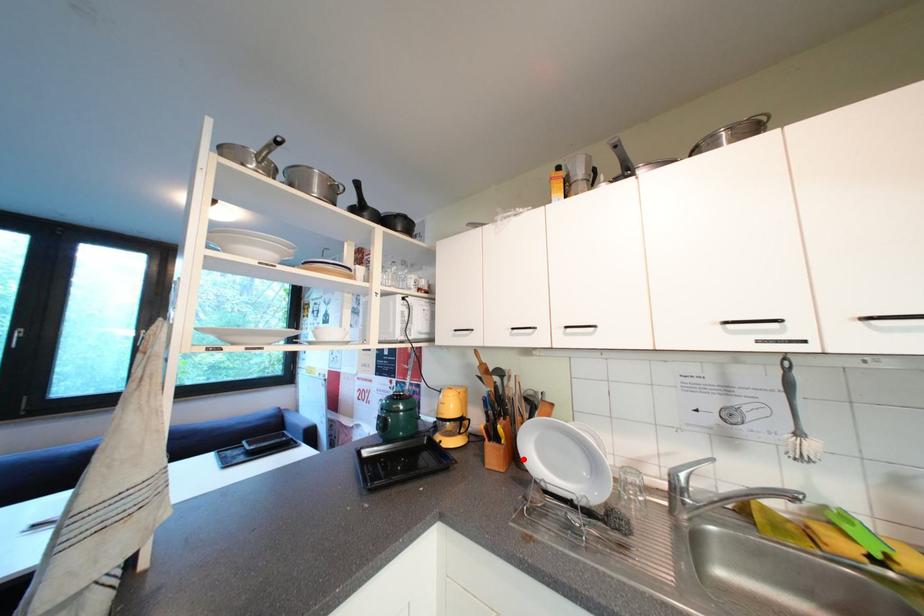
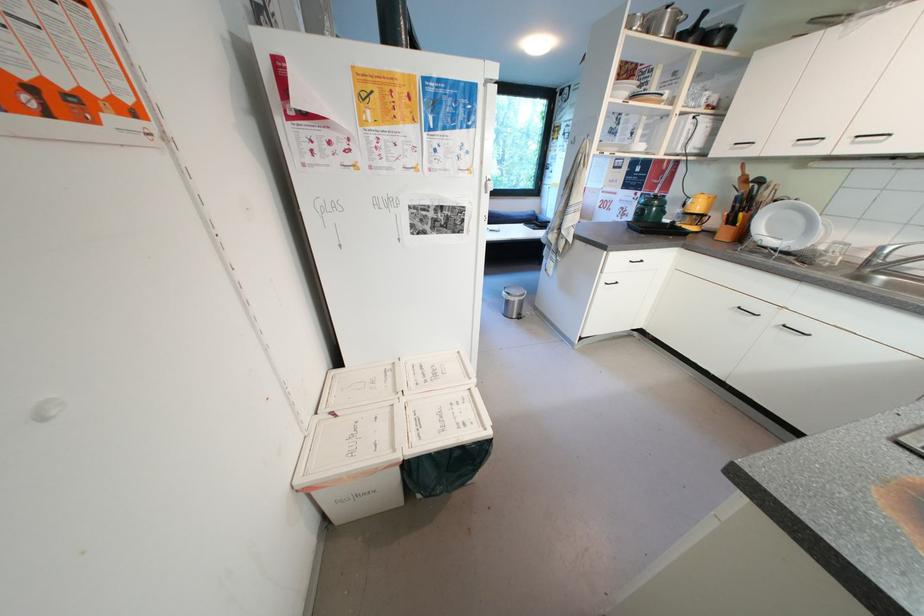
Question: I am providing you with two images of the same scene from different viewpoints. In image1, a red point is highlighted. Considering the same 3D point in image2, which of the following is correct?

Choices:
 (A) It is closer
 (B) It is farther

Answer: (A)